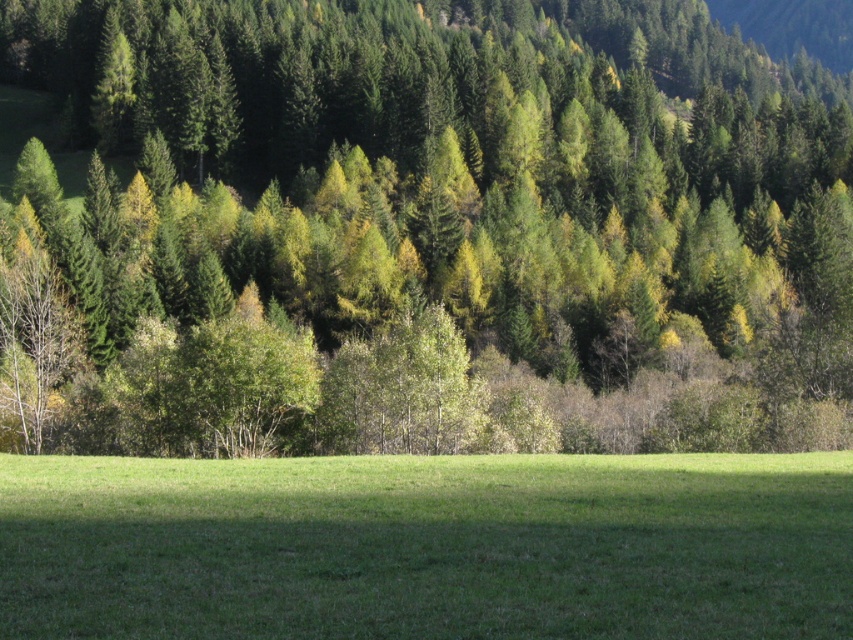
You are a hiker standing at the edge of the green grassy field at center and want to take a photo of the green matte tree at upper center. Since you have a wide angle lens, will you be able to capture the entire tree in your photo without moving closer or further away?

The green matte tree at upper center is bigger than the green grassy field at center, so it might be challenging to capture the entire tree in the photo without adjusting your position, as the tree is larger in size compared to the field.

You are standing in the middle of the green grassy field at center and want to reach the base of the green matte tree at upper center. Considering the height difference between them, do you think the tree will block your view of the forest behind it?

The green matte tree at upper center is taller than the green grassy field at center, so yes, the tree will likely block your view of the forest behind it due to its greater height.

You are standing in the middle of the forest and see two points marked in the image. Which point is closer to you, point (16,54) or point (288,586)?

Point (16,54) is closer to you because it is further to the viewer than point (288,586).